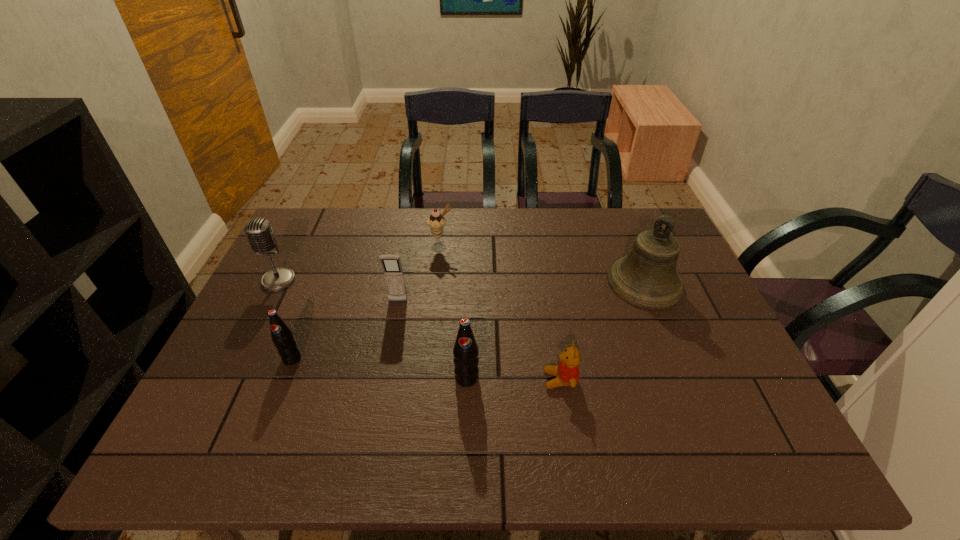
The height and width of the screenshot is (540, 960). In order to click on pop at the near edge in this screenshot , I will do `click(465, 351)`.

Where is `teddy bear located at the near edge`? Image resolution: width=960 pixels, height=540 pixels. teddy bear located at the near edge is located at coordinates (567, 372).

Where is `pop located at the left edge`? The height and width of the screenshot is (540, 960). pop located at the left edge is located at coordinates (282, 336).

Locate an element on the screen. The image size is (960, 540). microphone that is at the left edge is located at coordinates (259, 232).

This screenshot has width=960, height=540. Find the location of `object positioned at the right edge`. object positioned at the right edge is located at coordinates (647, 277).

At what (x,y) coordinates should I click in order to perform the action: click on free space at the far edge of the desktop. Please return your answer as a coordinate pair (x, y). Image resolution: width=960 pixels, height=540 pixels. Looking at the image, I should click on (404, 212).

Find the location of a particular element. The image size is (960, 540). free space at the left edge of the desktop is located at coordinates (319, 271).

Locate an element on the screen. The height and width of the screenshot is (540, 960). vacant area at the far left corner is located at coordinates (293, 235).

Locate an element on the screen. vacant area that lies between the sixth object from right to left and the taller pop is located at coordinates (379, 368).

The height and width of the screenshot is (540, 960). I want to click on free space between the cellular telephone and the shorter pop, so click(345, 330).